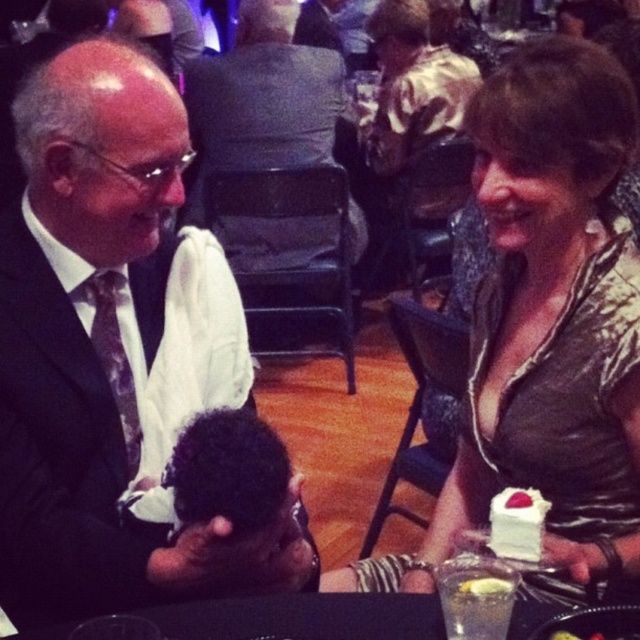
You are a photographer at a formal event. You want to capture a photo of the dark curly hair at center and the white cream cake at right. Based on their positions, which object is closer to the camera?

The dark curly hair at center is closer to the camera because it is positioned above the white cream cake at right, indicating it is in a higher plane and thus nearer to the viewer.

You are at a formal event and see the shiny metallic dress at center and the dark curly hair at center. Which one is higher up in the image?

The shiny metallic dress at center is taller than dark curly hair at center, so the shiny metallic dress at center is higher up in the image.

You are sitting at a table with a black suit at left and a white cream cake at right. Which object is closer to you?

The black suit at left is closer to you because it is further to the viewer than the white cream cake at right.